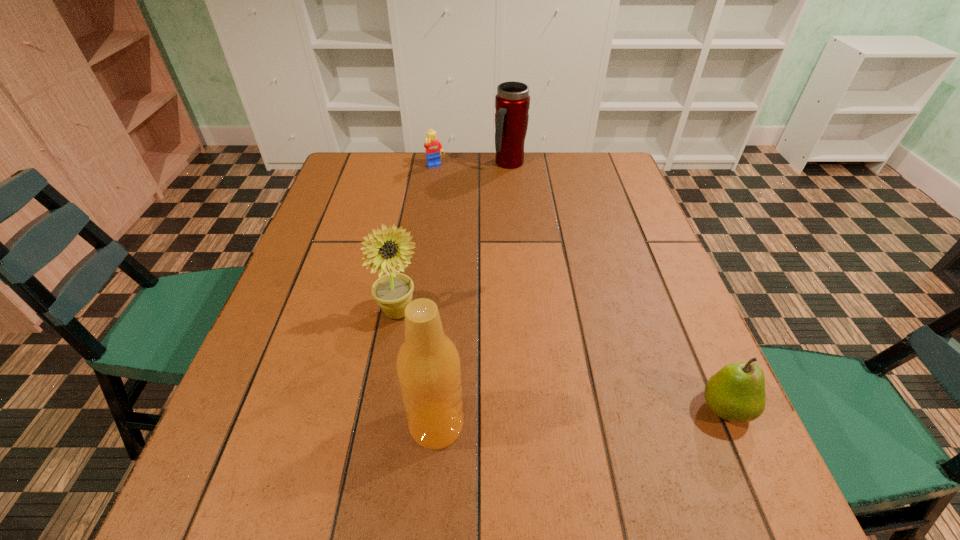
Find the location of a particular element. This screenshot has width=960, height=540. vacant space located 0.210m on the face of the Lego is located at coordinates (463, 207).

Locate an element on the screen. The height and width of the screenshot is (540, 960). vacant position located 0.330m on the face of the Lego is located at coordinates (480, 232).

Locate an element on the screen. The image size is (960, 540). vacant area situated on the face of the Lego is located at coordinates (456, 197).

The height and width of the screenshot is (540, 960). Find the location of `free space located 0.090m on the side with the handle of the thermos bottle`. free space located 0.090m on the side with the handle of the thermos bottle is located at coordinates (519, 189).

Where is `free spot located 0.350m on the side with the handle of the thermos bottle`? Image resolution: width=960 pixels, height=540 pixels. free spot located 0.350m on the side with the handle of the thermos bottle is located at coordinates (x=542, y=244).

Where is `free spot located on the side with the handle of the thermos bottle`? The height and width of the screenshot is (540, 960). free spot located on the side with the handle of the thermos bottle is located at coordinates click(522, 194).

What are the coordinates of `Lego that is at the far edge` in the screenshot? It's located at (433, 147).

Identify the location of thermos bottle at the far edge. (512, 102).

The width and height of the screenshot is (960, 540). In order to click on beer bottle located in the near edge section of the desktop in this screenshot , I will do `click(428, 366)`.

Identify the location of pear that is at the near edge. The height and width of the screenshot is (540, 960). click(736, 392).